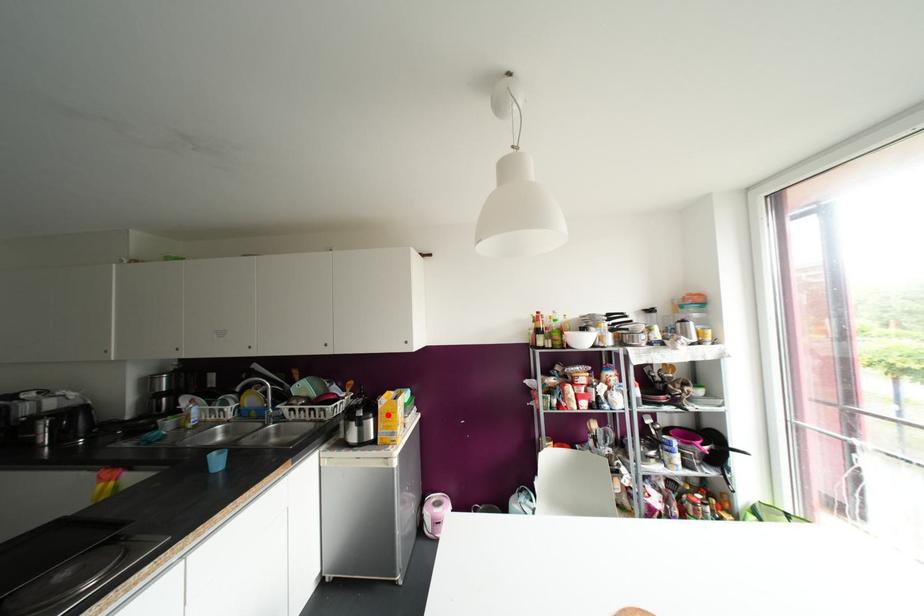
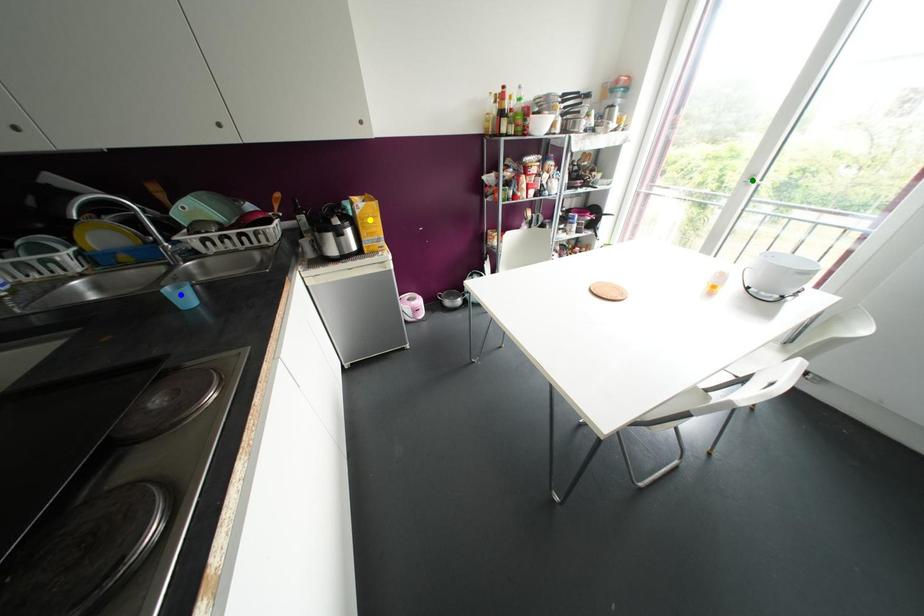
Question: I am providing you with two images of the same scene from different viewpoints. A red point is marked on the first image. You are given multiple points on the second image. Can you choose the point in image 2 that corresponds to the point in image 1?

Choices:
 (A) yellow point
 (B) green point
 (C) blue point

Answer: (A)